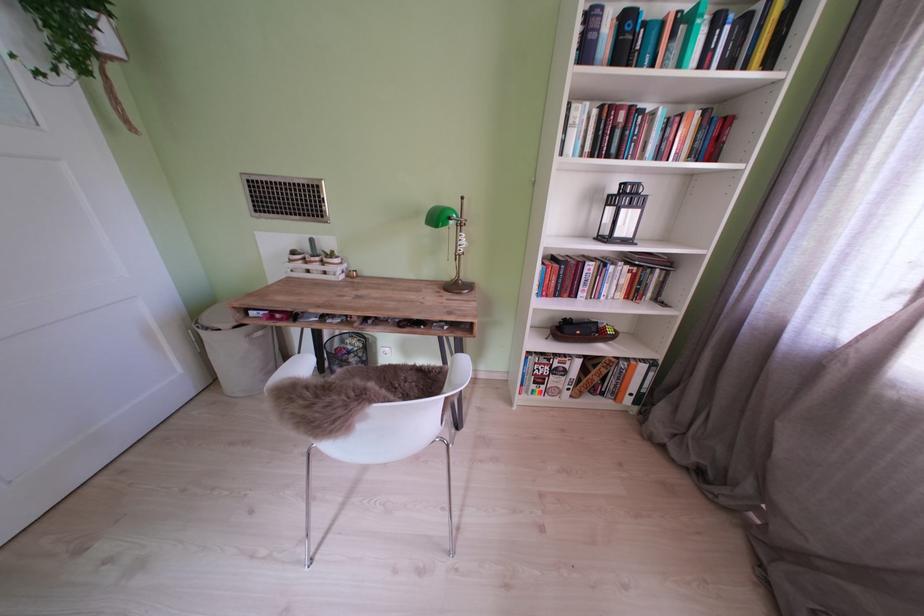
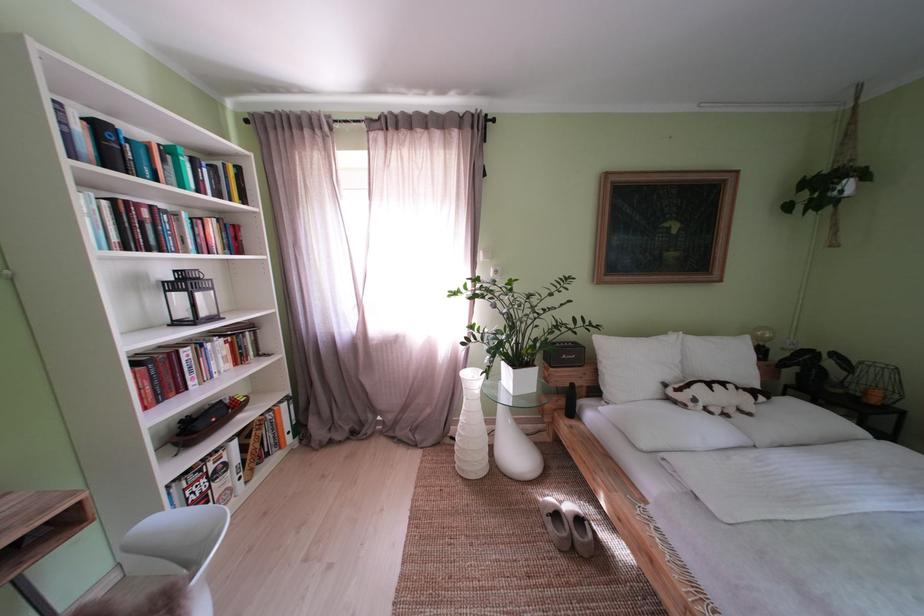
Find the pixel in the second image that matches point 562,338 in the first image.

(187, 450)